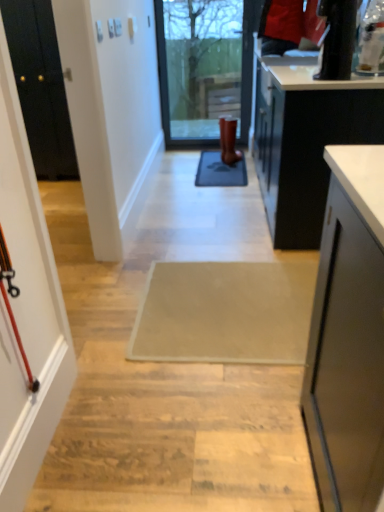
Question: Which direction should I rotate to look at gray rubber doormat at center, marked as the second doormat in a bottom-to-top arrangement?

Choices:
 (A) left
 (B) right

Answer: (B)

Question: Would you say white glossy countertop at upper right contains transparent glass door at center?

Choices:
 (A) yes
 (B) no

Answer: (B)

Question: From a real-world perspective, does white glossy countertop at upper right sit lower than transparent glass door at center?

Choices:
 (A) yes
 (B) no

Answer: (B)

Question: Can you confirm if white glossy countertop at upper right is thinner than transparent glass door at center?

Choices:
 (A) yes
 (B) no

Answer: (B)

Question: Is white glossy countertop at upper right at the right side of transparent glass door at center?

Choices:
 (A) yes
 (B) no

Answer: (A)

Question: Is white glossy countertop at upper right not within transparent glass door at center?

Choices:
 (A) no
 (B) yes

Answer: (B)

Question: Is the position of white glossy countertop at upper right less distant than that of transparent glass door at center?

Choices:
 (A) yes
 (B) no

Answer: (A)

Question: Does beige fabric doormat at center, which is the 1th doormat from bottom to top, have a lesser width compared to matte black screen door at left?

Choices:
 (A) yes
 (B) no

Answer: (B)

Question: Is the position of beige fabric doormat at center, marked as the second doormat in a top-to-bottom arrangement, more distant than that of matte black screen door at left?

Choices:
 (A) yes
 (B) no

Answer: (A)

Question: Considering the relative sizes of beige fabric doormat at center, which is the second doormat from back to front, and matte black screen door at left in the image provided, is beige fabric doormat at center, which is the second doormat from back to front, smaller than matte black screen door at left?

Choices:
 (A) no
 (B) yes

Answer: (B)

Question: Can you confirm if beige fabric doormat at center, which is the 1th doormat from bottom to top, is positioned to the right of matte black screen door at left?

Choices:
 (A) yes
 (B) no

Answer: (A)

Question: Considering the relative sizes of beige fabric doormat at center, which is the 1th doormat from bottom to top, and matte black screen door at left in the image provided, is beige fabric doormat at center, which is the 1th doormat from bottom to top, shorter than matte black screen door at left?

Choices:
 (A) yes
 (B) no

Answer: (A)

Question: Is beige fabric doormat at center, marked as the second doormat in a top-to-bottom arrangement, taller than matte black screen door at left?

Choices:
 (A) no
 (B) yes

Answer: (A)

Question: Does brown leather boot at center have a lesser width compared to gray rubber doormat at center, positioned as the second doormat in front-to-back order?

Choices:
 (A) yes
 (B) no

Answer: (A)